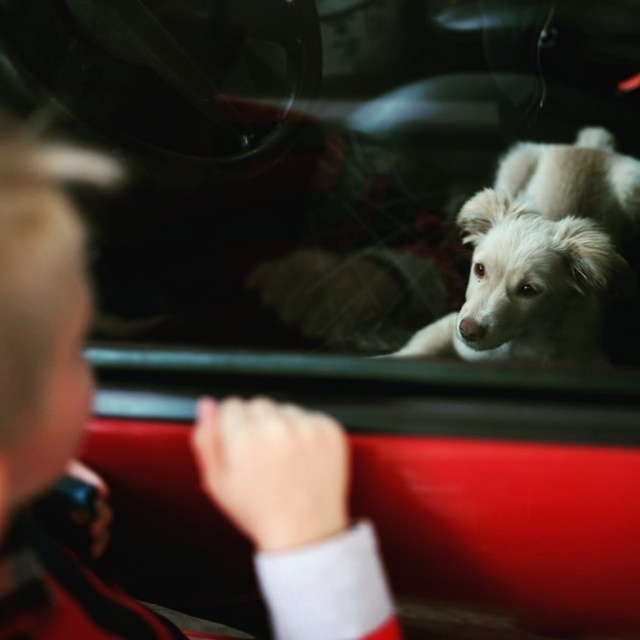
Question: Which point is farther from the camera taking this photo?

Choices:
 (A) (102, 611)
 (B) (616, 228)

Answer: (B)

Question: Can you confirm if blonde hair at upper left is wider than white fluffy dog at center?

Choices:
 (A) no
 (B) yes

Answer: (A)

Question: Can you confirm if blonde hair at upper left is positioned to the left of white fluffy dog at center?

Choices:
 (A) no
 (B) yes

Answer: (B)

Question: Is blonde hair at upper left below white fluffy dog at center?

Choices:
 (A) no
 (B) yes

Answer: (B)

Question: Which object is closer to the camera taking this photo?

Choices:
 (A) blonde hair at upper left
 (B) white fluffy dog at center

Answer: (A)

Question: Which object is farther from the camera taking this photo?

Choices:
 (A) white fluffy dog at center
 (B) blonde hair at upper left

Answer: (A)